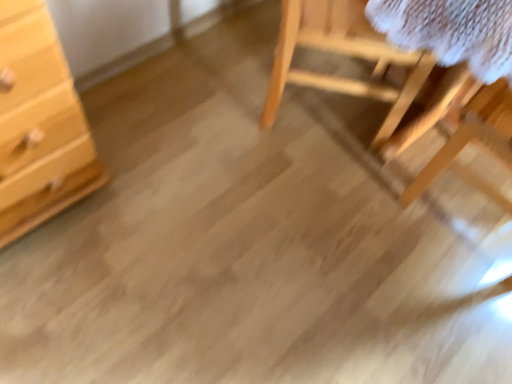
In order to click on free area in between light wood chest of drawers at left and natural wood chair at upper right in this screenshot , I will do `click(198, 145)`.